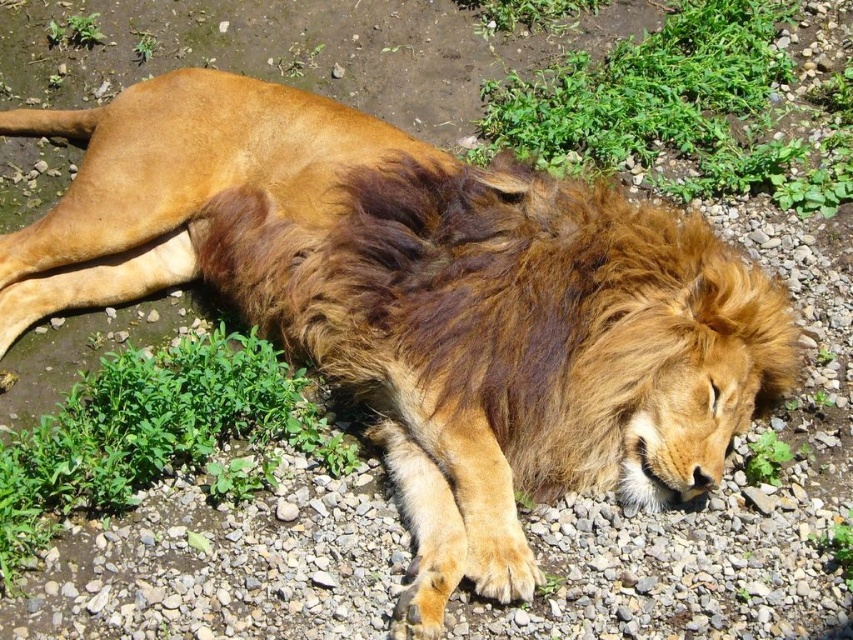
In the scene shown: You are a gardener trying to maintain a balanced landscape. You notice two patches of green leafy grass at upper center and green leafy grass at lower left in the scene. Which patch should you prioritize trimming to achieve a more uniform appearance?

The green leafy grass at upper center should be prioritized for trimming since it is larger in size than the green leafy grass at lower left, helping to create a more uniform appearance.

You are standing in front of a lion resting on a stony ground with vegetation. There is a point at coordinates point [700,195]. Can you reach this point without moving the lion?

The point [700,195] is 3.41 meters away from the camera, so yes, you can reach it without moving the lion if you are within that distance.

You are a photographer aiming to capture a closeup of the lion while ensuring both the green leafy grass at upper center and the green leafy grass at lower left are visible in the frame. Which grass should you focus on to ensure depth of field includes both?

To ensure both the green leafy grass at upper center and the green leafy grass at lower left are in focus, you should focus on the green leafy grass at upper center since it is closer to the viewer, allowing the depth of field to extend backward to the farther grass at lower left.